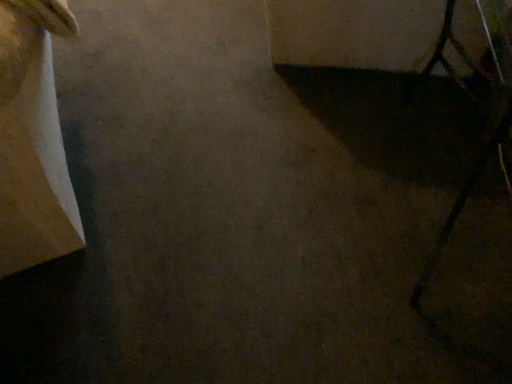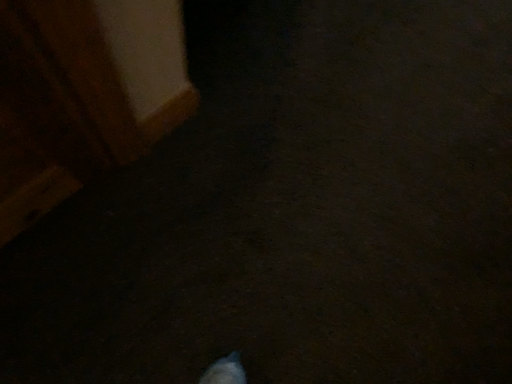
Question: Which way did the camera rotate in the video?

Choices:
 (A) rotated upward
 (B) rotated downward

Answer: (B)